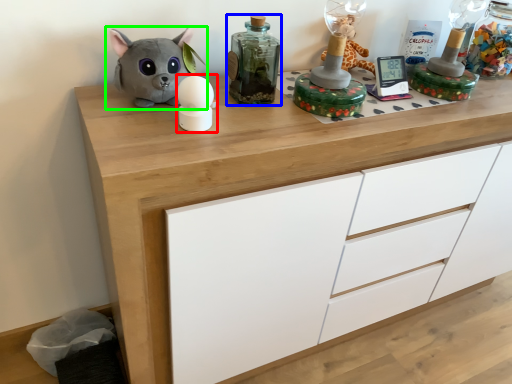
Question: Based on their relative distances, which object is farther from toy (highlighted by a red box)? Choose from bottle (highlighted by a blue box) and toy (highlighted by a green box).

Choices:
 (A) bottle
 (B) toy

Answer: (A)